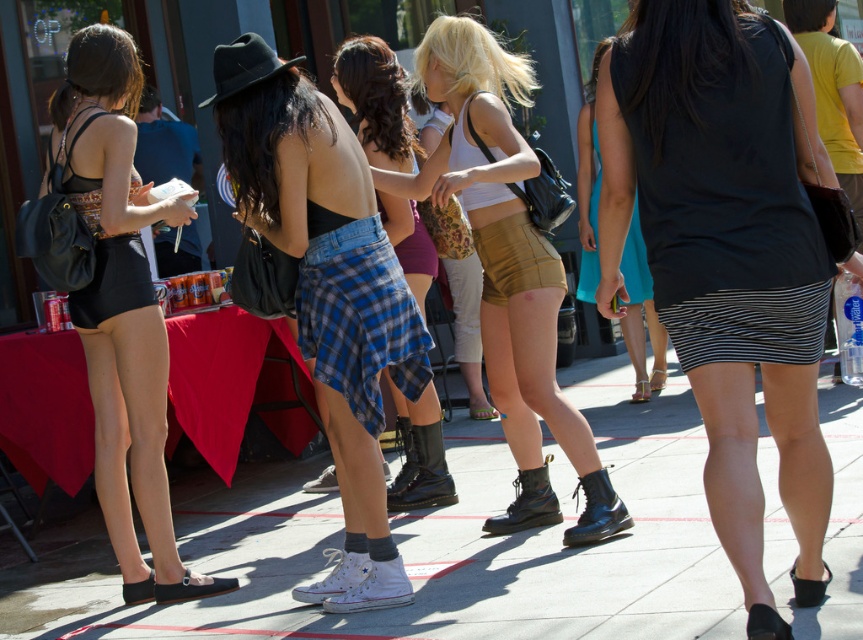
You are organizing a clothing display and need to arrange the black matte skirt at center and the plaid skirt at center side by side. Given their widths, which skirt should be placed on the left to ensure they fit within the display area without overlapping?

The plaid skirt at center should be placed on the left since its width is narrower than the black matte skirt at center, allowing both to fit side by side without overlapping.

You are standing at the edge of the gathering and want to walk to the building in the background. Which direction should you move relative to the white concrete pavement at center?

The white concrete pavement at center is located at point (427, 547) in 2D coordinates, so you should move towards the building in the background by heading in the direction of the white concrete pavement at center as it is centrally positioned in the scene.

You are at an outdoor event and need to walk from the white concrete pavement at center to the black matte skirt at center. Which object is smaller in size?

The white concrete pavement at center is smaller than the black matte skirt at center according to the description.